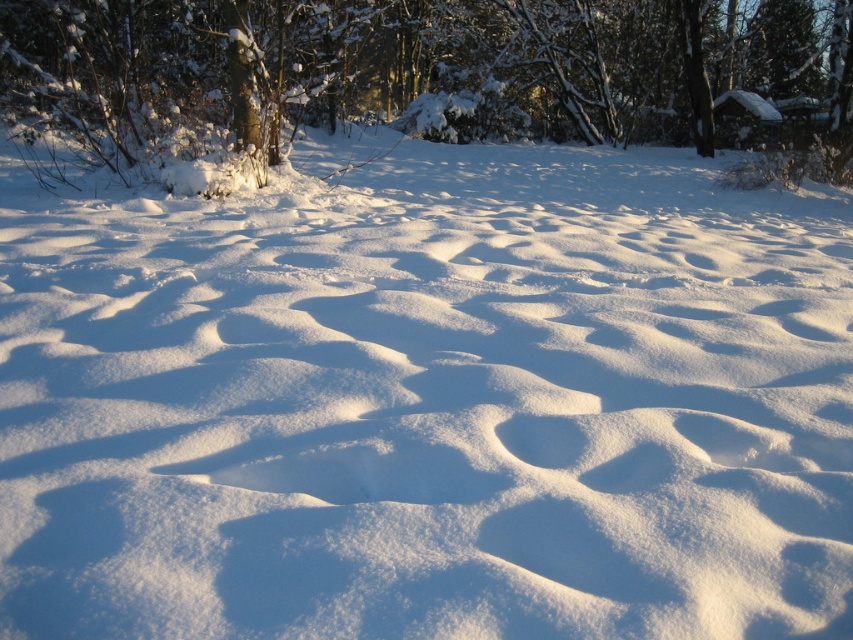
You are standing in a snowy winter landscape and see a point marked at coordinates (436, 74). What object does this point correspond to?

The point corresponds to the snowy bark tree at upper center.

You are an animal tracker analyzing the snowy landscape. You notice the snowy bark tree at upper center and the white fluffy footprint at center. Which object is taller?

The snowy bark tree at upper center is taller than the white fluffy footprint at center.

You are an explorer in the winter landscape. You see the snowy bark tree at upper center and the white fluffy footprint at center. Which object is closer to you?

The snowy bark tree at upper center is closer to you because the white fluffy footprint at center is behind it.